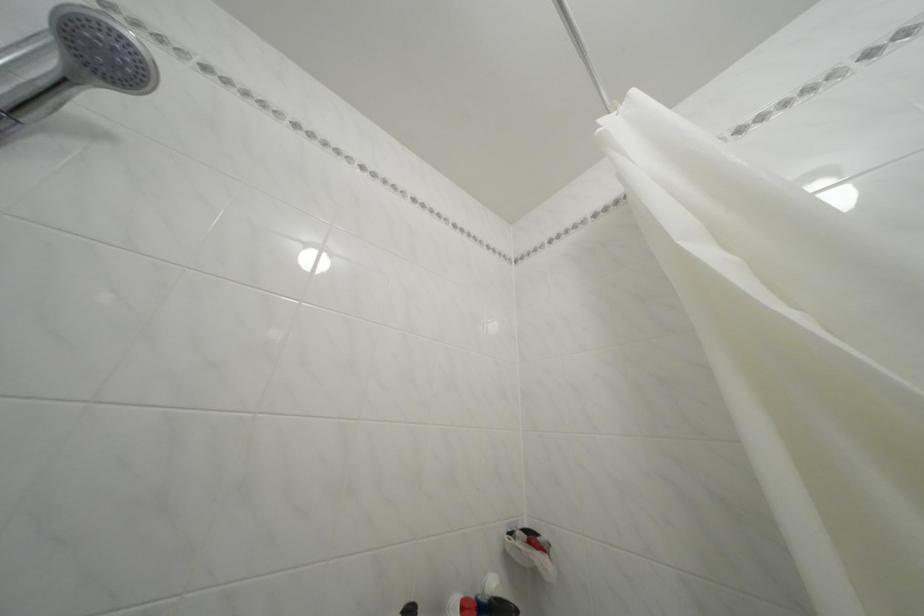
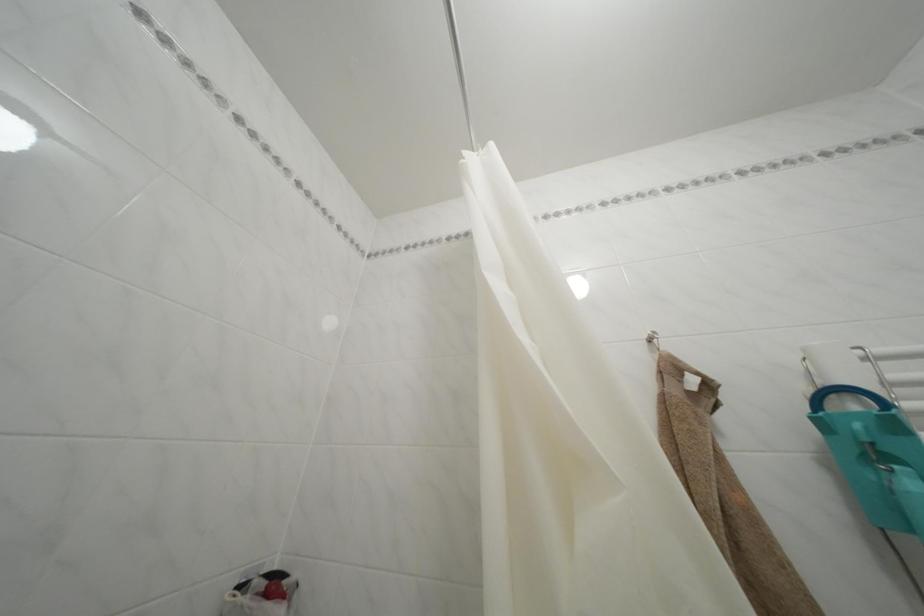
Question: Based on the continuous images, in which direction is the camera rotating? Reply with the corresponding letter.

Choices:
 (A) Left
 (B) Right
 (C) Up
 (D) Down

Answer: (B)